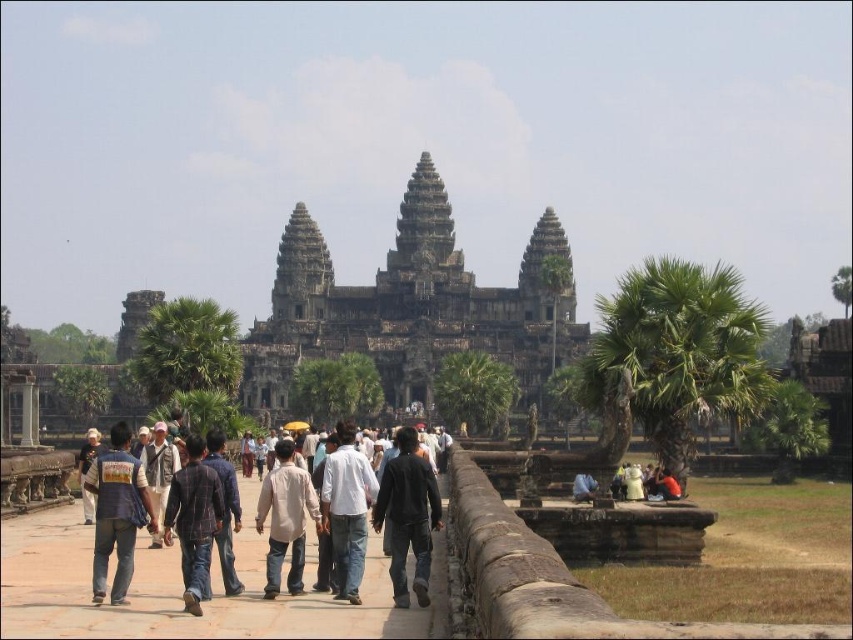
You are a photographer standing at the Angkor Wat temple complex. You want to take a photo that includes both the dark gray stone hindu temple at center and the light brown cotton shirt at center. Which object should you focus on first if you want to ensure both are in sharp focus?

The dark gray stone hindu temple at center is larger in size than the light brown cotton shirt at center, so focusing on the larger temple first will help ensure both are in sharp focus.

Based on the photo, you are a photographer planning to take a photo of the Angkor Wat temple. You notice a denim jacket at lower left and a plaid shirt at center in your frame. Which clothing item should you adjust to ensure both are fully visible in the photo?

The denim jacket at lower left is taller than the plaid shirt at center. To ensure both are fully visible, you should adjust the denim jacket at lower left as it is taller and might block the view of the plaid shirt at center.